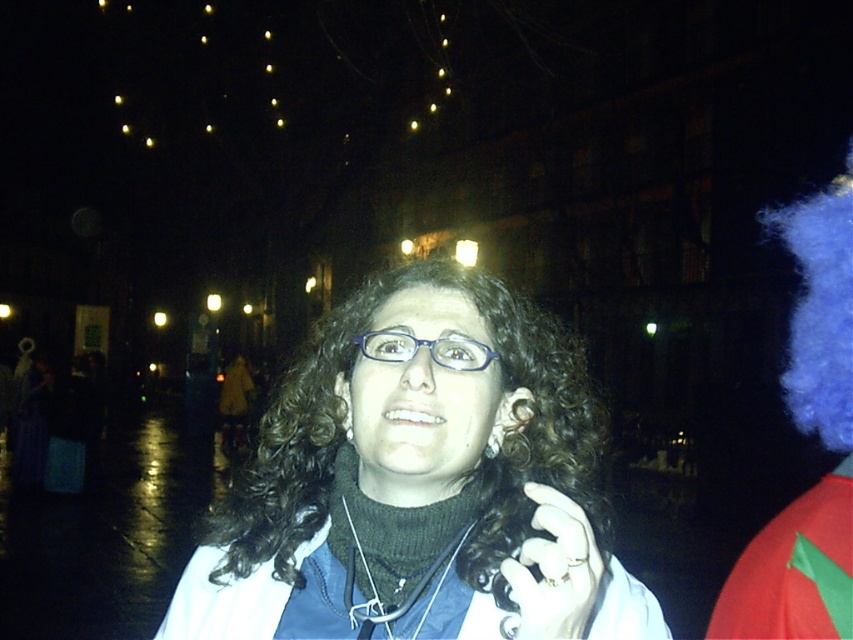
Consider the image. Can you confirm if matte blue jacket at center is bigger than blue fluffy wig at right?

Yes, matte blue jacket at center is bigger than blue fluffy wig at right.

Can you confirm if matte blue jacket at center is positioned below blue fluffy wig at right?

Incorrect, matte blue jacket at center is not positioned below blue fluffy wig at right.

You are a GUI agent. You are given a task and a screenshot of the screen. Output one action in this format:
    pyautogui.click(x=<x>, y=<y>)
    Task: Click on the matte blue jacket at center
    The image size is (853, 640).
    Given the screenshot: What is the action you would take?
    pyautogui.click(x=422, y=483)

Find the location of a particular element. matte blue jacket at center is located at coordinates (422, 483).

Who is higher up, blue fluffy wig at right or matte blue glasses at center?

Positioned higher is matte blue glasses at center.

Who is more distant from viewer, (780,228) or (485,353)?

Positioned behind is point (780,228).

Is point (849, 614) closer to viewer compared to point (459, 369)?

No, (849, 614) is behind (459, 369).

Identify the location of blue fluffy wig at right. This screenshot has width=853, height=640. (820, 438).

Looking at this image, does matte blue jacket at center appear on the left side of matte blue glasses at center?

Correct, you'll find matte blue jacket at center to the left of matte blue glasses at center.

The image size is (853, 640). What do you see at coordinates (422, 483) in the screenshot? I see `matte blue jacket at center` at bounding box center [422, 483].

Locate an element on the screen. Image resolution: width=853 pixels, height=640 pixels. matte blue jacket at center is located at coordinates (422, 483).